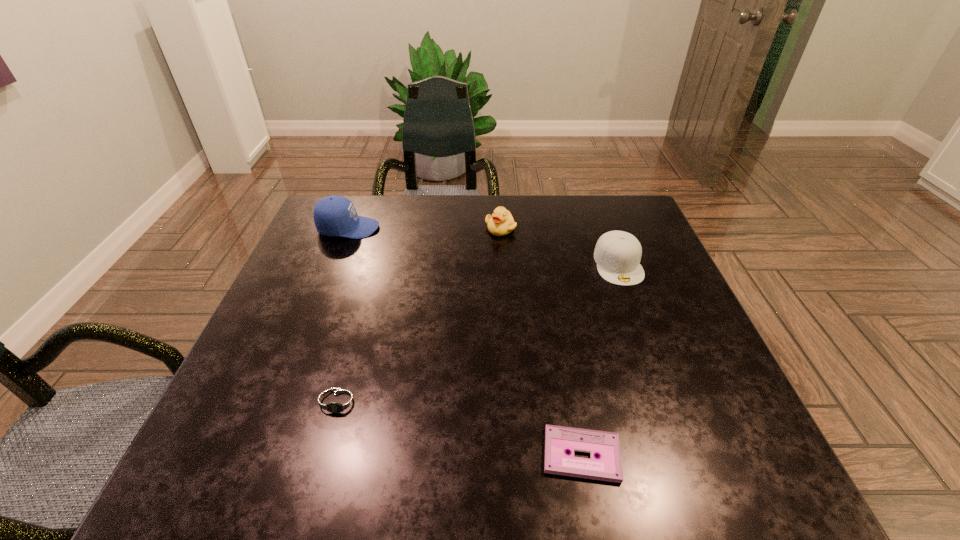
Locate an element on the screen. This screenshot has width=960, height=540. vacant space located on the front-facing side of the nearer cap is located at coordinates (684, 440).

The image size is (960, 540). I want to click on free point located on the face of the watch, so click(317, 488).

Identify the location of free location located on the back of the shortest object. This screenshot has width=960, height=540. (572, 404).

Locate an element on the screen. cap present at the far edge is located at coordinates (335, 215).

Where is `duckling that is at the far edge`? The width and height of the screenshot is (960, 540). duckling that is at the far edge is located at coordinates (501, 223).

Where is `object positioned at the near edge`? The width and height of the screenshot is (960, 540). object positioned at the near edge is located at coordinates (558, 439).

Find the location of `cap situated at the left edge`. cap situated at the left edge is located at coordinates (335, 215).

At what (x,y) coordinates should I click in order to perform the action: click on watch present at the left edge. Please return your answer as a coordinate pair (x, y). This screenshot has width=960, height=540. Looking at the image, I should click on (339, 403).

Identify the location of object present at the right edge. The image size is (960, 540). (617, 253).

Where is `object present at the far left corner`? This screenshot has height=540, width=960. object present at the far left corner is located at coordinates (335, 215).